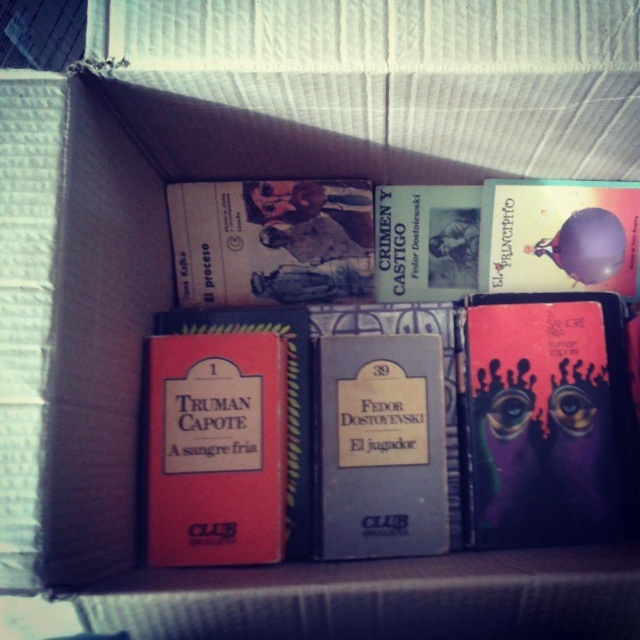
You are organizing books in a box and notice the purple matte book at right and the hardcover book at upper center. Which book is placed below the other?

The purple matte book at right is positioned under the hardcover book at upper center.

You are organizing books in a box and notice two specific books. The first is a matte red book at center left, and the second is a shiny metallic book at upper right. Based on their positions, which book is placed lower in the stack?

The matte red book at center left is positioned under the shiny metallic book at upper right, so it is placed lower in the stack.